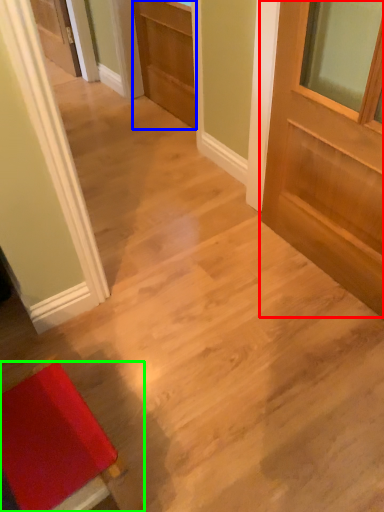
Question: Which object is the closest to the door (highlighted by a red box)? Choose among these: door (highlighted by a blue box) or furniture (highlighted by a green box).

Choices:
 (A) door
 (B) furniture

Answer: (A)